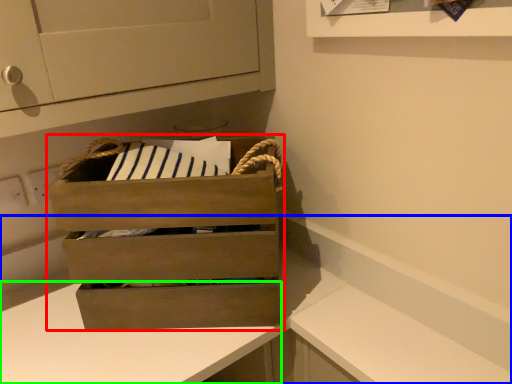
Question: Considering the real-world distances, which object is farthest from chest of drawers (highlighted by a red box)? counter (highlighted by a blue box) or counter (highlighted by a green box)?

Choices:
 (A) counter
 (B) counter

Answer: (A)